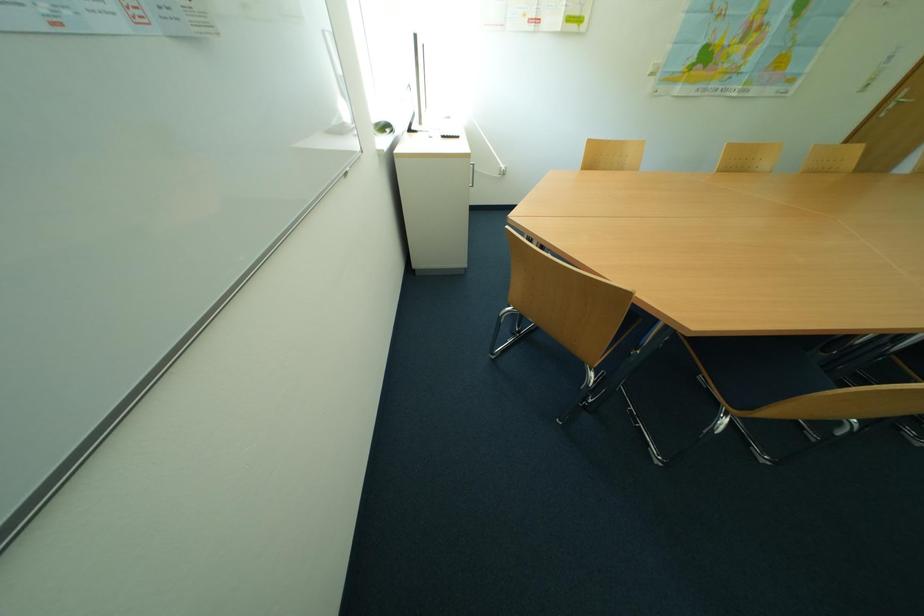
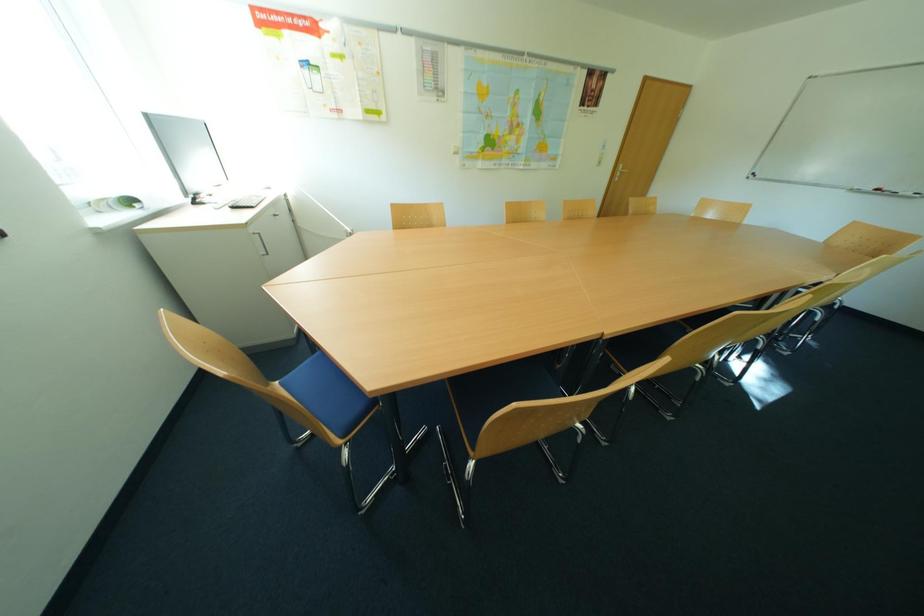
Question: How did the camera likely rotate?

Choices:
 (A) Left
 (B) Right
 (C) Up
 (D) Down

Answer: (B)